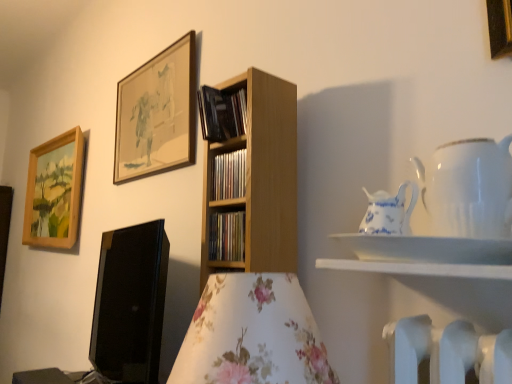
Measure the distance between point (502,43) and camera.

Point (502,43) and camera are 32.52 inches apart.

Describe the element at coordinates (222, 113) in the screenshot. I see `black matte book at upper center, the 3th book when ordered from bottom to top` at that location.

What do you see at coordinates (425, 256) in the screenshot? This screenshot has height=384, width=512. I see `white glossy shelf at upper right` at bounding box center [425, 256].

Measure the distance between point (146,235) and camera.

Point (146,235) and camera are 4.56 feet apart.

This screenshot has width=512, height=384. Identify the location of white porcelain teapot at upper right, which is counted as the 2th tableware, starting from the left. (469, 188).

From a real-world perspective, is black glossy computer monitor at lower left on top of blue and white porcelain pitcher at upper right, which appears as the 2th tableware when viewed from the right?

Incorrect, from a real-world perspective, black glossy computer monitor at lower left is lower than blue and white porcelain pitcher at upper right, which appears as the 2th tableware when viewed from the right.

Considering the relative sizes of black glossy computer monitor at lower left and blue and white porcelain pitcher at upper right, which appears as the 2th tableware when viewed from the right, in the image provided, is black glossy computer monitor at lower left wider than blue and white porcelain pitcher at upper right, which appears as the 2th tableware when viewed from the right,?

Yes.

Is black glossy computer monitor at lower left with blue and white porcelain pitcher at upper right, which appears as the 2th tableware when viewed from the right?

black glossy computer monitor at lower left and blue and white porcelain pitcher at upper right, which appears as the 2th tableware when viewed from the right, are not in contact.

Is wooden shelf at center, the second book positioned from the top, located outside black glossy computer monitor at lower left?

Yes, wooden shelf at center, the second book positioned from the top, is not within black glossy computer monitor at lower left.

Which is more distant, (216, 197) or (150, 354)?

Positioned behind is point (150, 354).

Locate an element on the screen. The image size is (512, 384). computer monitor below the wooden shelf at center, which appears as the 2th book when ordered from the bottom (from a real-world perspective) is located at coordinates (130, 304).

Is the position of wooden shelf at center, the second book positioned from the top, less distant than that of black glossy computer monitor at lower left?

No.

Considering the relative sizes of white porcelain teapot at upper right, which is counted as the 2th tableware, starting from the left, and blue and white porcelain pitcher at upper right, the first tableware in the left-to-right sequence, in the image provided, is white porcelain teapot at upper right, which is counted as the 2th tableware, starting from the left, wider than blue and white porcelain pitcher at upper right, the first tableware in the left-to-right sequence,?

Yes, white porcelain teapot at upper right, which is counted as the 2th tableware, starting from the left, is wider than blue and white porcelain pitcher at upper right, the first tableware in the left-to-right sequence.

Can blue and white porcelain pitcher at upper right, the first tableware in the left-to-right sequence, be found inside white porcelain teapot at upper right, which is counted as the 2th tableware, starting from the left?

Yes, blue and white porcelain pitcher at upper right, the first tableware in the left-to-right sequence, is surrounded by white porcelain teapot at upper right, which is counted as the 2th tableware, starting from the left.

From the image's perspective, is white porcelain teapot at upper right, which is the 1th tableware from right to left, positioned above or below blue and white porcelain pitcher at upper right, the first tableware in the left-to-right sequence?

Clearly, from the image's perspective, white porcelain teapot at upper right, which is the 1th tableware from right to left, is above blue and white porcelain pitcher at upper right, the first tableware in the left-to-right sequence.

Can you confirm if white porcelain teapot at upper right, which is counted as the 2th tableware, starting from the left, is positioned to the right of blue and white porcelain pitcher at upper right, the first tableware in the left-to-right sequence?

Indeed, white porcelain teapot at upper right, which is counted as the 2th tableware, starting from the left, is positioned on the right side of blue and white porcelain pitcher at upper right, the first tableware in the left-to-right sequence.

Measure the distance between black matte book at upper center, the 3th book when ordered from bottom to top, and wooden shelf at center, which appears as the 2th book when ordered from the bottom.

They are 10.75 centimeters apart.

In terms of width, does black matte book at upper center, the 3th book when ordered from bottom to top, look wider or thinner when compared to wooden shelf at center, which appears as the 2th book when ordered from the bottom?

Clearly, black matte book at upper center, the 3th book when ordered from bottom to top, has more width compared to wooden shelf at center, which appears as the 2th book when ordered from the bottom.

From the image's perspective, who appears lower, black matte book at upper center, the 3th book when ordered from bottom to top, or wooden shelf at center, which appears as the 2th book when ordered from the bottom?

From the image's view, wooden shelf at center, which appears as the 2th book when ordered from the bottom, is below.

Which of these two, wooden shelf at center, the third book viewed from the top, or wooden shelf at center, the second book positioned from the top, is wider?

wooden shelf at center, the second book positioned from the top, is wider.

Who is smaller, wooden shelf at center, the 1th book ordered from the bottom, or wooden shelf at center, the second book positioned from the top?

wooden shelf at center, the 1th book ordered from the bottom, is smaller.

Is wooden shelf at center, the 1th book ordered from the bottom, not close to wooden shelf at center, the second book positioned from the top?

No, wooden shelf at center, the 1th book ordered from the bottom, is not far from wooden shelf at center, the second book positioned from the top.

Is wooden shelf at center, the third book viewed from the top, in front of wooden shelf at center, the second book positioned from the top?

Yes, wooden shelf at center, the third book viewed from the top, is closer to the viewer.

Measure the distance from wooden shelf at center, the third book viewed from the top, to black matte book at upper center, marked as the 1th book in a top-to-bottom arrangement.

wooden shelf at center, the third book viewed from the top, is 10.41 inches away from black matte book at upper center, marked as the 1th book in a top-to-bottom arrangement.

Is wooden shelf at center, the 1th book ordered from the bottom, shorter than black matte book at upper center, the 3th book when ordered from bottom to top?

Yes, wooden shelf at center, the 1th book ordered from the bottom, is shorter than black matte book at upper center, the 3th book when ordered from bottom to top.

Is wooden shelf at center, the third book viewed from the top, next to black matte book at upper center, the 3th book when ordered from bottom to top?

No, wooden shelf at center, the third book viewed from the top, is not in contact with black matte book at upper center, the 3th book when ordered from bottom to top.

Locate an element on the screen. This screenshot has height=384, width=512. shelf beneath the wooden framed artwork at upper center, arranged as the second picture frame when viewed from the right (from a real-world perspective) is located at coordinates (425, 256).

Is wooden framed artwork at upper center, the 2th picture frame positioned from the left, facing towards white glossy shelf at upper right?

No.

Considering the sizes of objects wooden framed artwork at upper center, the 2th picture frame positioned from the left, and white glossy shelf at upper right in the image provided, who is smaller, wooden framed artwork at upper center, the 2th picture frame positioned from the left, or white glossy shelf at upper right?

With smaller size is white glossy shelf at upper right.

I want to click on computer monitor lying behind the blue and white porcelain pitcher at upper right, which appears as the 2th tableware when viewed from the right, so click(130, 304).

You are a GUI agent. You are given a task and a screenshot of the screen. Output one action in this format:
    pyautogui.click(x=<x>, y=<y>)
    Task: Click on the computer monitor on the left of wooden shelf at center, which appears as the 2th book when ordered from the bottom
    This screenshot has height=384, width=512.
    Given the screenshot: What is the action you would take?
    pyautogui.click(x=130, y=304)

Considering their positions, is black glossy computer monitor at lower left positioned closer to white porcelain teapot at upper right, which is the 1th tableware from right to left, than wooden framed artwork at upper center, the 2th picture frame positioned from the left?

black glossy computer monitor at lower left is positioned closer to the anchor white porcelain teapot at upper right, which is the 1th tableware from right to left.

Looking at the image, which one is located further to black glossy computer monitor at lower left, blue and white porcelain pitcher at upper right, the first tableware in the left-to-right sequence, or wooden shelf at center, which appears as the 2th book when ordered from the bottom?

blue and white porcelain pitcher at upper right, the first tableware in the left-to-right sequence.

When comparing their distances from wooden shelf at center, the second book positioned from the top, does white glossy shelf at upper right or wooden shelf at center, the 1th book ordered from the bottom, seem closer?

wooden shelf at center, the 1th book ordered from the bottom, is closer to wooden shelf at center, the second book positioned from the top.

Considering their positions, is gold metallic picture frame at upper right, which ranks as the 3th picture frame in back-to-front order, positioned closer to wooden framed artwork at upper center, the 2th picture frame positioned from the left, than white porcelain teapot at upper right, which is counted as the 2th tableware, starting from the left?

white porcelain teapot at upper right, which is counted as the 2th tableware, starting from the left.

Based on the photo, based on their spatial positions, is wooden shelf at center, the second book positioned from the top, or black glossy computer monitor at lower left further from wooden framed artwork at upper center, acting as the second picture frame starting from the back?

The object further to wooden framed artwork at upper center, acting as the second picture frame starting from the back, is wooden shelf at center, the second book positioned from the top.

In the scene shown: Considering their positions, is blue and white porcelain pitcher at upper right, the first tableware in the left-to-right sequence, positioned closer to white porcelain teapot at upper right, which is counted as the 2th tableware, starting from the left, than black matte book at upper center, marked as the 1th book in a top-to-bottom arrangement?

blue and white porcelain pitcher at upper right, the first tableware in the left-to-right sequence, is positioned closer to the anchor white porcelain teapot at upper right, which is counted as the 2th tableware, starting from the left.

When comparing their distances from white glossy shelf at upper right, does white porcelain teapot at upper right, which is counted as the 2th tableware, starting from the left, or wooden shelf at center, the third book viewed from the top, seem closer?

The object closer to white glossy shelf at upper right is white porcelain teapot at upper right, which is counted as the 2th tableware, starting from the left.

In the scene shown: Based on their spatial positions, is white porcelain teapot at upper right, which is the 1th tableware from right to left, or gold metallic picture frame at upper right, marked as the 1th picture frame in a front-to-back arrangement, closer to black matte book at upper center, marked as the 1th book in a top-to-bottom arrangement?

white porcelain teapot at upper right, which is the 1th tableware from right to left, is positioned closer to the anchor black matte book at upper center, marked as the 1th book in a top-to-bottom arrangement.

Where is `picture frame positioned between black matte book at upper center, marked as the 1th book in a top-to-bottom arrangement, and wooden picture frame at upper left, the 3th picture frame viewed from the front, from near to far`? The width and height of the screenshot is (512, 384). picture frame positioned between black matte book at upper center, marked as the 1th book in a top-to-bottom arrangement, and wooden picture frame at upper left, the 3th picture frame viewed from the front, from near to far is located at coordinates pos(157,113).

In order to click on shelf situated between black matte book at upper center, marked as the 1th book in a top-to-bottom arrangement, and gold metallic picture frame at upper right, acting as the third picture frame starting from the left, from left to right in this screenshot , I will do `click(425, 256)`.

Locate an element on the screen. The height and width of the screenshot is (384, 512). book between white glossy shelf at upper right and wooden shelf at center, which appears as the 2th book when ordered from the bottom, in the front-back direction is located at coordinates (227, 236).

Find the location of a particular element. This screenshot has height=384, width=512. tableware between white glossy shelf at upper right and blue and white porcelain pitcher at upper right, which appears as the 2th tableware when viewed from the right, in the front-back direction is located at coordinates (469, 188).